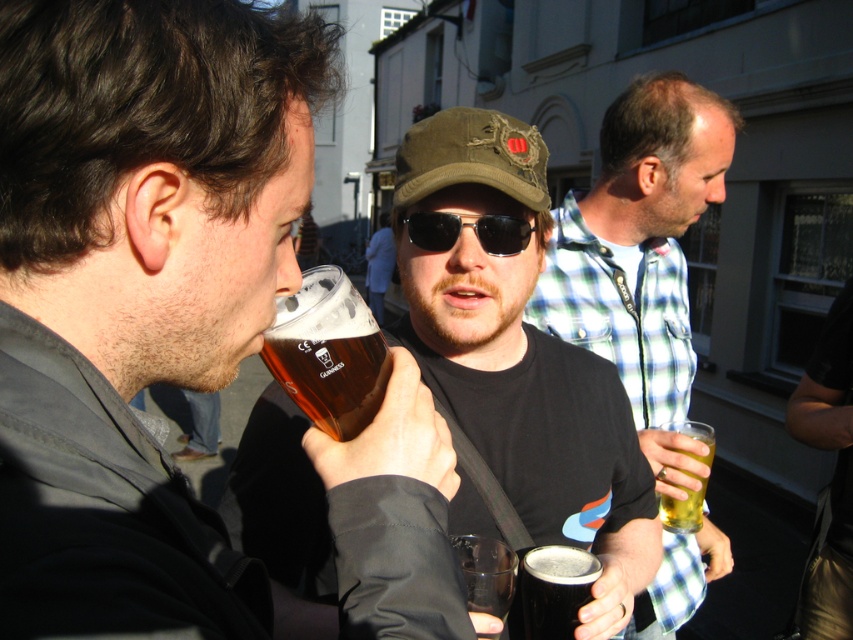
Who is positioned more to the right, dark matte stout at lower center or translucent glass beer at center?

translucent glass beer at center is more to the right.

Is point (550, 627) less distant than point (701, 486)?

Yes, point (550, 627) is in front of point (701, 486).

Identify the location of dark matte stout at lower center. The image size is (853, 640). (555, 589).

Which is behind, point (663, 125) or point (498, 588)?

Point (663, 125)

Can you confirm if matte black t-shirt at center is smaller than translucent plastic cup at center?

Incorrect, matte black t-shirt at center is not smaller in size than translucent plastic cup at center.

This screenshot has width=853, height=640. Describe the element at coordinates (641, 253) in the screenshot. I see `matte black t-shirt at center` at that location.

At what (x,y) coordinates should I click in order to perform the action: click on matte black t-shirt at center. Please return your answer as a coordinate pair (x, y). The height and width of the screenshot is (640, 853). Looking at the image, I should click on (641, 253).

Does matte glass mug at center have a greater width compared to amber glass at center?

Correct, the width of matte glass mug at center exceeds that of amber glass at center.

Measure the distance from matte glass mug at center to amber glass at center.

The distance of matte glass mug at center from amber glass at center is 6.28 inches.

Identify the location of matte glass mug at center. (136, 291).

Identify the location of matte glass mug at center. Image resolution: width=853 pixels, height=640 pixels. (x=136, y=291).